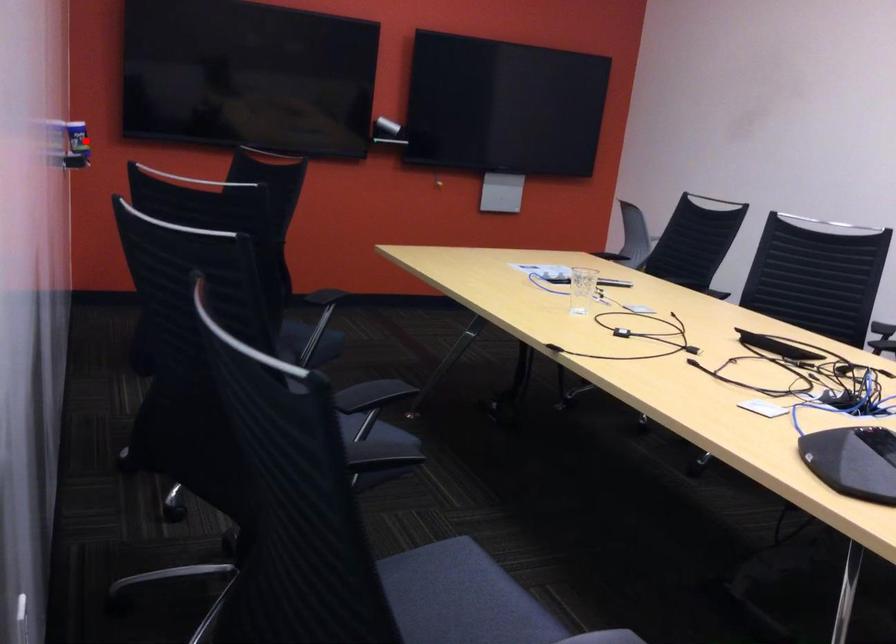
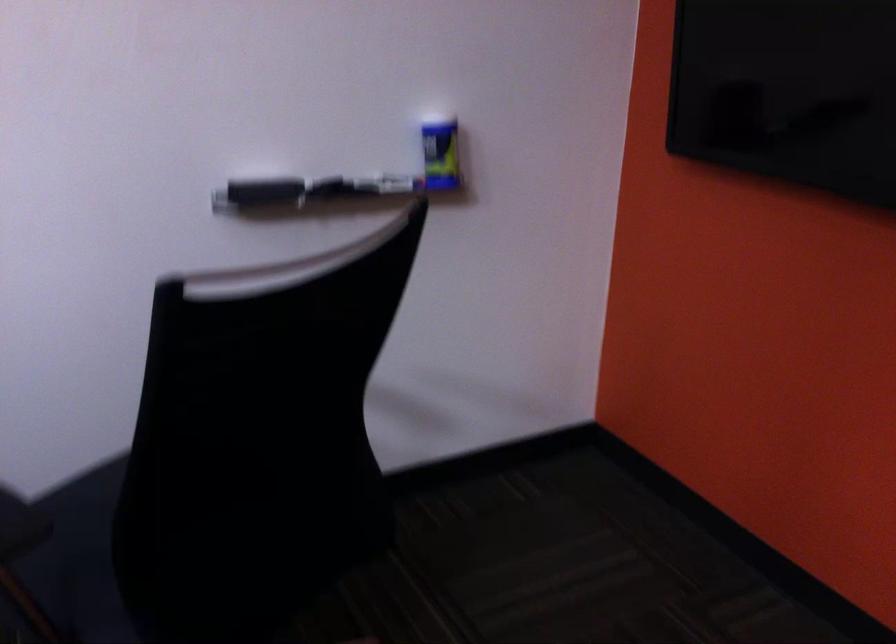
The point at the highlighted location is marked in the first image. Where is the corresponding point in the second image?

(355, 181)